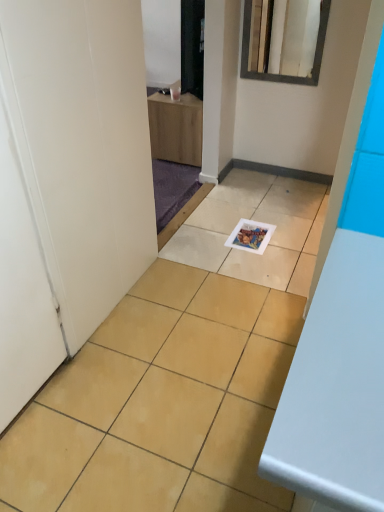
I want to click on free space to the left of matte paper magazine at center, so click(x=208, y=242).